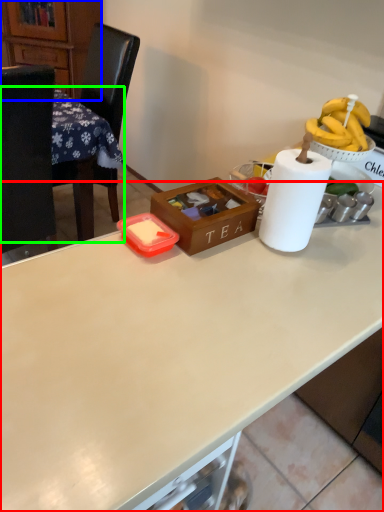
Question: Based on their relative distances, which object is nearer to desk (highlighted by a red box)? Choose from cabinetry (highlighted by a blue box) and table (highlighted by a green box).

Choices:
 (A) cabinetry
 (B) table

Answer: (B)